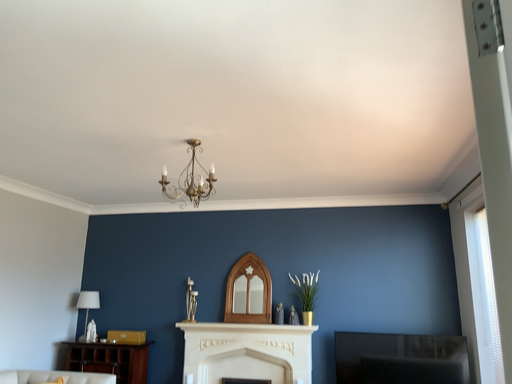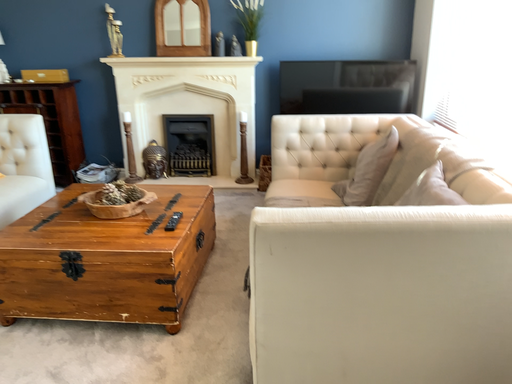
Question: How did the camera likely rotate when shooting the video?

Choices:
 (A) rotated upward
 (B) rotated downward

Answer: (B)